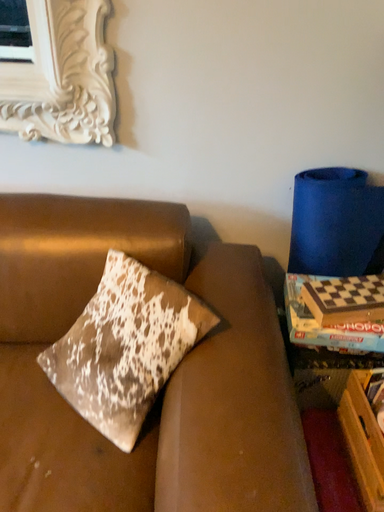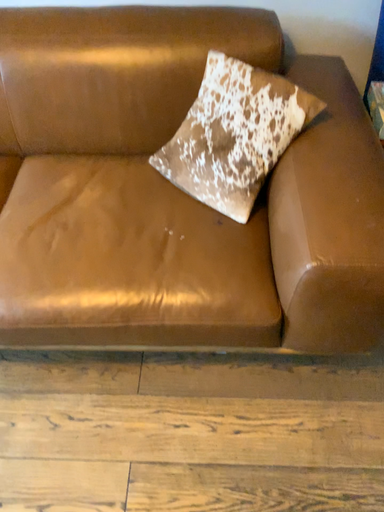
Question: Which way did the camera rotate in the video?

Choices:
 (A) rotated upward
 (B) rotated downward

Answer: (B)